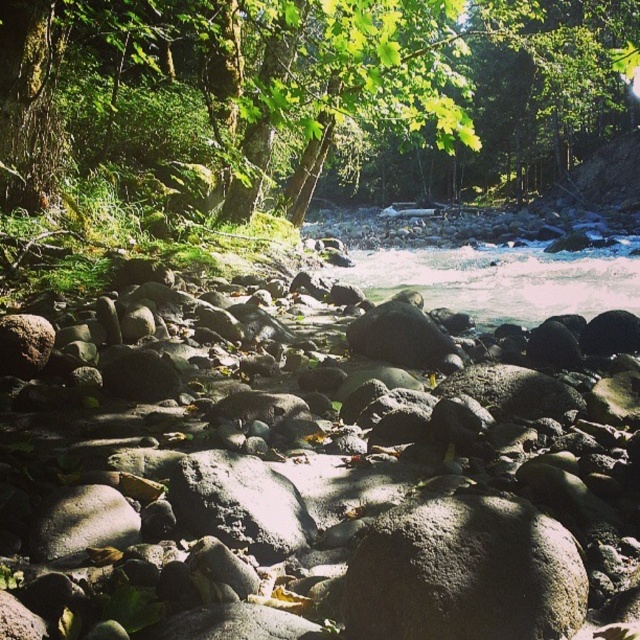
Question: Where is gray smooth rocks at center located in relation to green mossy tree at upper center in the image?

Choices:
 (A) left
 (B) right

Answer: (A)

Question: Is gray smooth rocks at center bigger than green mossy tree at upper center?

Choices:
 (A) no
 (B) yes

Answer: (A)

Question: Can you confirm if gray smooth rocks at center is smaller than green mossy tree at upper center?

Choices:
 (A) no
 (B) yes

Answer: (B)

Question: Which point is closer to the camera taking this photo?

Choices:
 (A) (454, 180)
 (B) (308, 593)

Answer: (B)